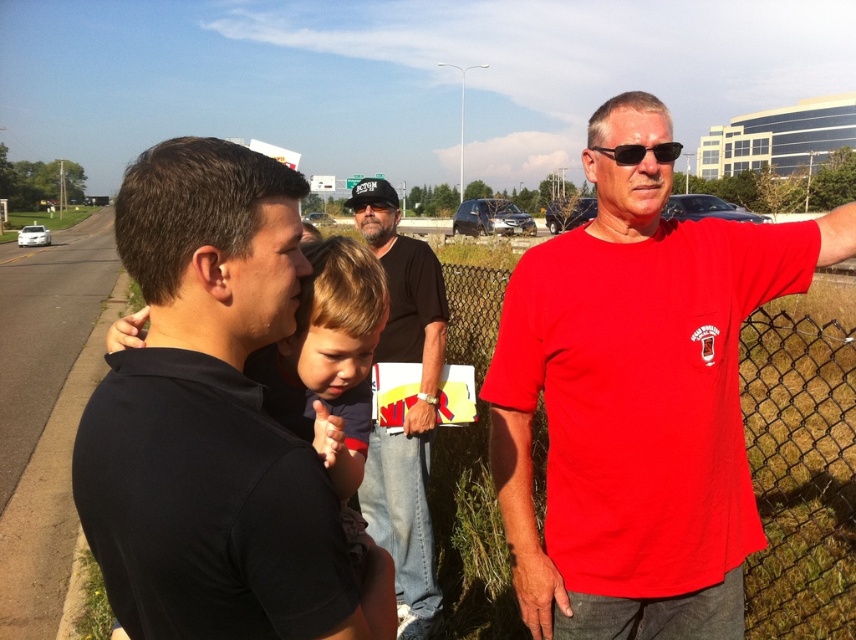
Between matte red t-shirt at right and black matte shirt at left, which one appears on the right side from the viewer's perspective?

Positioned to the right is matte red t-shirt at right.

Which is in front, point (619, 131) or point (193, 499)?

Point (193, 499) is in front.

You are a GUI agent. You are given a task and a screenshot of the screen. Output one action in this format:
    pyautogui.click(x=<x>, y=<y>)
    Task: Click on the matte red t-shirt at right
    
    Given the screenshot: What is the action you would take?
    pyautogui.click(x=637, y=400)

What do you see at coordinates (214, 420) in the screenshot? This screenshot has width=856, height=640. I see `black matte shirt at left` at bounding box center [214, 420].

Where is `black matte shirt at left`? This screenshot has width=856, height=640. black matte shirt at left is located at coordinates click(214, 420).

Identify the location of matte red t-shirt at right. (637, 400).

Is matte red t-shirt at right closer to camera compared to black cotton t-shirt at center?

That is True.

The image size is (856, 640). Identify the location of matte red t-shirt at right. (637, 400).

This screenshot has width=856, height=640. I want to click on matte red t-shirt at right, so click(x=637, y=400).